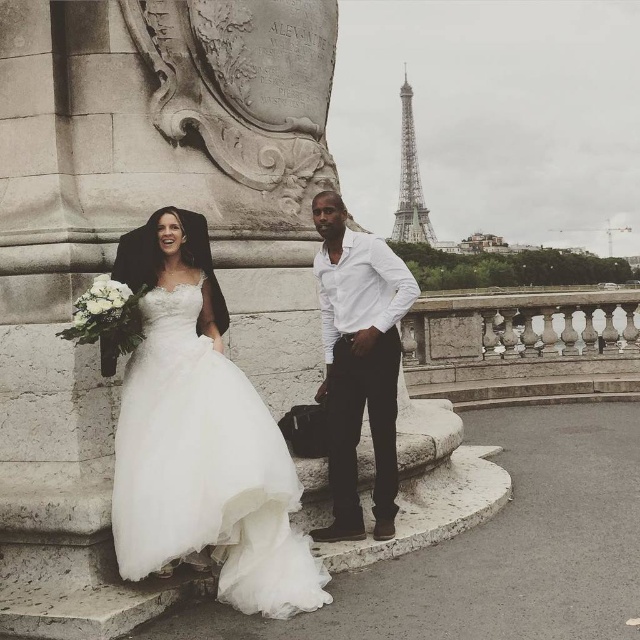
Question: Does white tulle dress at left have a larger size compared to metallic silver eiffel tower at upper right?

Choices:
 (A) yes
 (B) no

Answer: (B)

Question: Can you confirm if white smooth shirt at center is positioned above metallic silver eiffel tower at upper right?

Choices:
 (A) no
 (B) yes

Answer: (A)

Question: Considering the real-world distances, which object is closest to the white smooth shirt at center?

Choices:
 (A) metallic silver eiffel tower at upper right
 (B) white tulle dress at left

Answer: (B)

Question: Can you confirm if white tulle dress at left is smaller than white smooth shirt at center?

Choices:
 (A) yes
 (B) no

Answer: (A)

Question: Which point is farther from the camera taking this photo?

Choices:
 (A) (404, 141)
 (B) (250, 468)
 (C) (346, 524)

Answer: (A)

Question: Estimate the real-world distances between objects in this image. Which object is closer to the white smooth shirt at center?

Choices:
 (A) white tulle dress at left
 (B) metallic silver eiffel tower at upper right

Answer: (A)